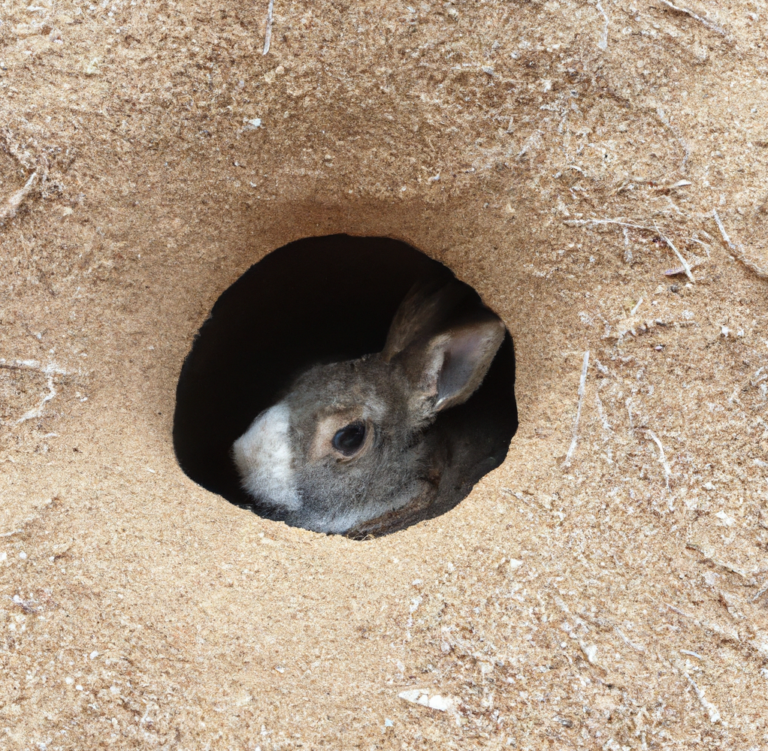
Identify the location of white fur. The width and height of the screenshot is (768, 751). (282, 481).